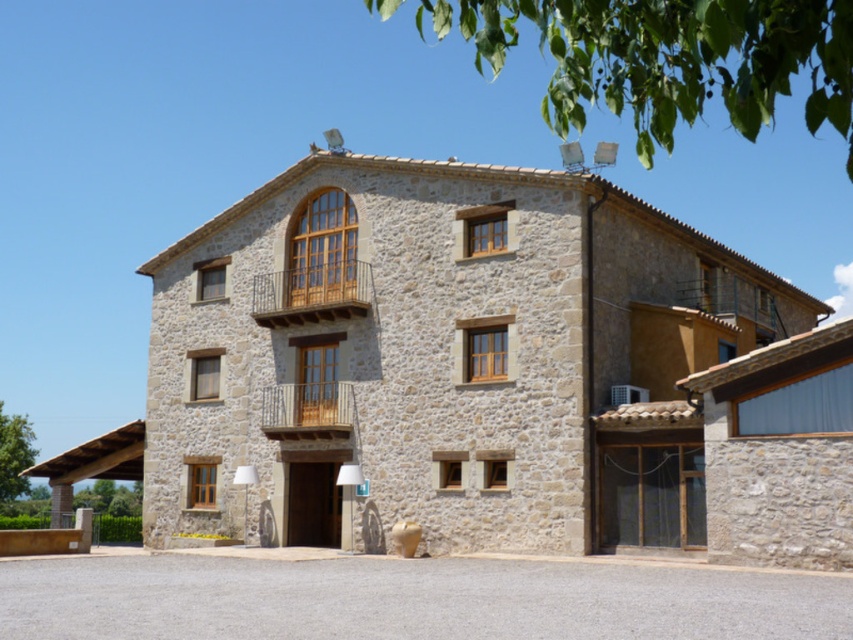
You are standing in front of the two story stone building. You see a point at coordinate (310,292). What is the material of the surface at that point?

The point at (310,292) is on wooden at upper center, so the surface there is made of wood.

You are standing in front of the two story stone building. You see a wooden at upper center and a wooden at center. Which one is higher?

The wooden at upper center is higher than the wooden at center because it is positioned above it.